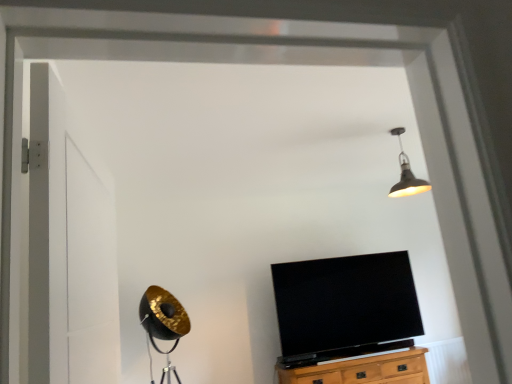
Locate an element on the screen. The width and height of the screenshot is (512, 384). free space above metallic pendant light at upper center (from a real-world perspective) is located at coordinates (403, 130).